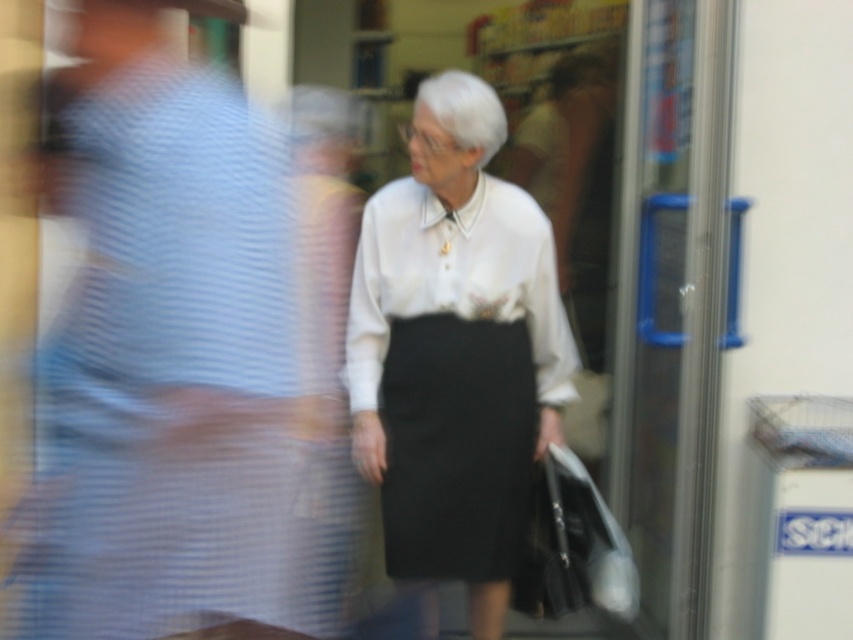
Question: Does black matte skirt at center appear on the right side of white matte shopping bag at lower right?

Choices:
 (A) yes
 (B) no

Answer: (B)

Question: Estimate the real-world distances between objects in this image. Which object is farther from the white matte shopping bag at lower right?

Choices:
 (A) black matte skirt at center
 (B) white matte blouse at center

Answer: (B)

Question: Which of the following is the closest to the observer?

Choices:
 (A) white matte shopping bag at lower right
 (B) white satin blouse at center
 (C) black matte skirt at center
 (D) white matte blouse at center

Answer: (D)

Question: Can you confirm if black matte skirt at center is positioned above white satin blouse at center?

Choices:
 (A) yes
 (B) no

Answer: (B)

Question: From the image, what is the correct spatial relationship of white satin blouse at center in relation to white matte shopping bag at lower right?

Choices:
 (A) below
 (B) above

Answer: (B)

Question: Which of these objects is positioned closest to the white satin blouse at center?

Choices:
 (A) black matte skirt at center
 (B) white matte blouse at center
 (C) white matte shopping bag at lower right

Answer: (B)